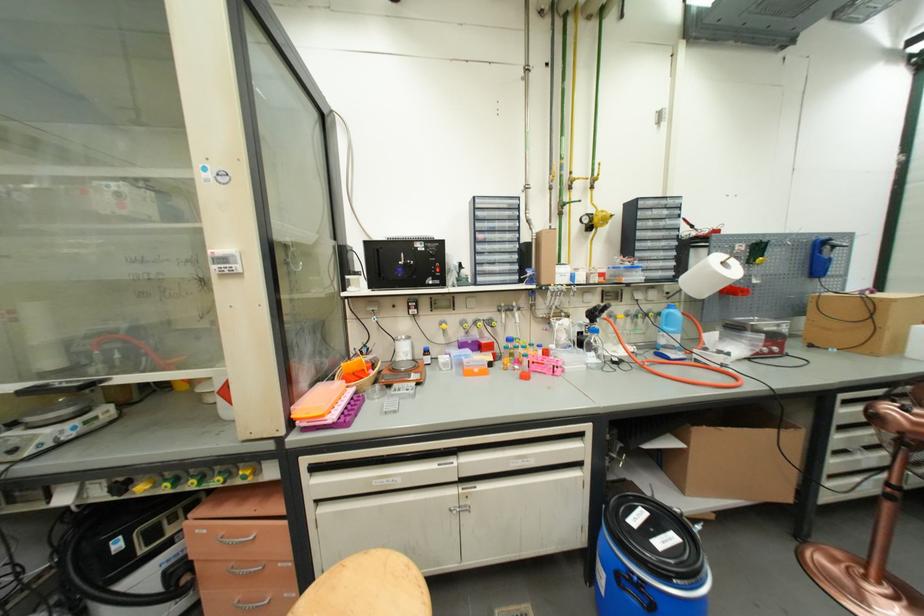
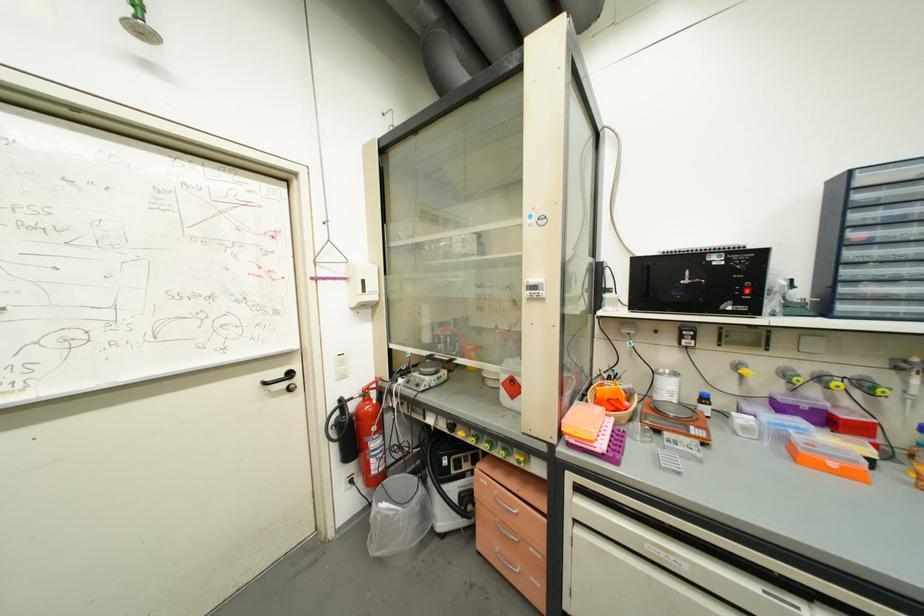
In the second image, find the point that corresponds to pixel 432 354 in the first image.

(710, 400)